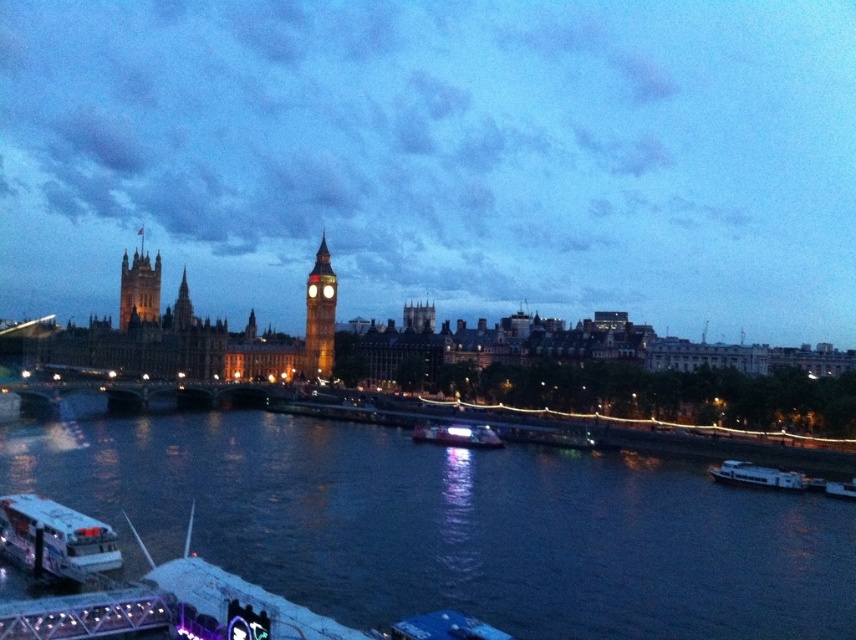
How far apart are white plastic boat at lower left and golden stone tower at left?

A distance of 378.54 feet exists between white plastic boat at lower left and golden stone tower at left.

Which is in front, point (74, 561) or point (122, 259)?

Point (74, 561)

Locate an element on the screen. The image size is (856, 640). white plastic boat at lower left is located at coordinates (55, 538).

Between point (317, 273) and point (749, 461), which one is positioned in front?

Positioned in front is point (749, 461).

Can you confirm if brick clock tower at center is wider than white glossy boat at lower right?

No, brick clock tower at center is not wider than white glossy boat at lower right.

The image size is (856, 640). I want to click on brick clock tower at center, so click(321, 316).

This screenshot has height=640, width=856. What do you see at coordinates (55, 538) in the screenshot?
I see `white plastic boat at lower left` at bounding box center [55, 538].

Between point (37, 548) and point (432, 429), which one is positioned in front?

Positioned in front is point (37, 548).

Identify the location of white plastic boat at lower left. Image resolution: width=856 pixels, height=640 pixels. (55, 538).